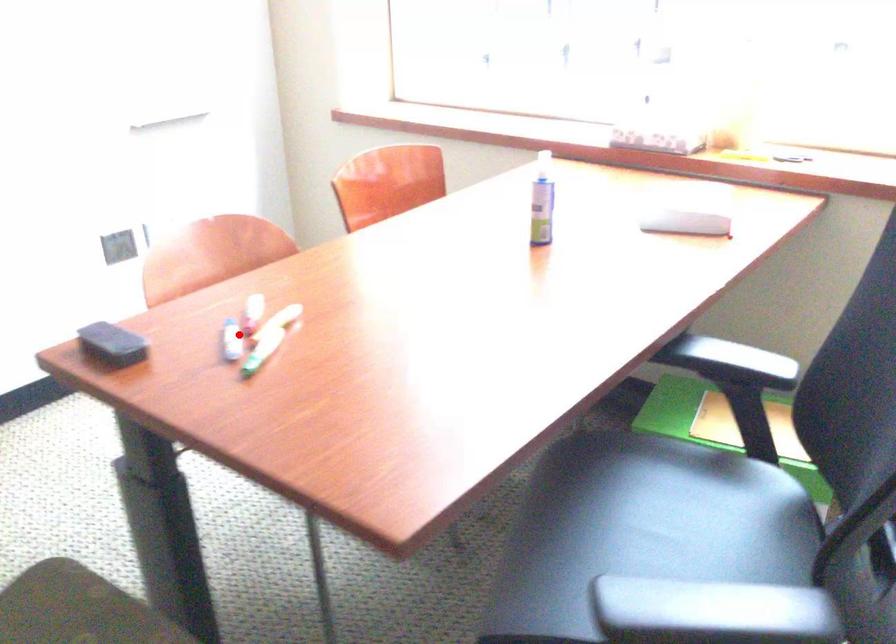
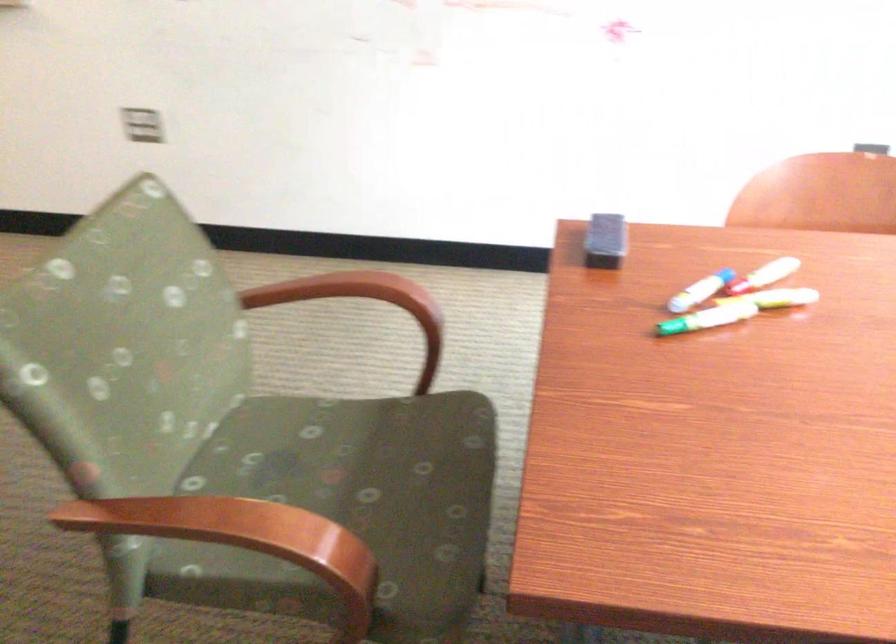
Locate, in the second image, the point that corresponds to the highlighted location in the first image.

(700, 290)